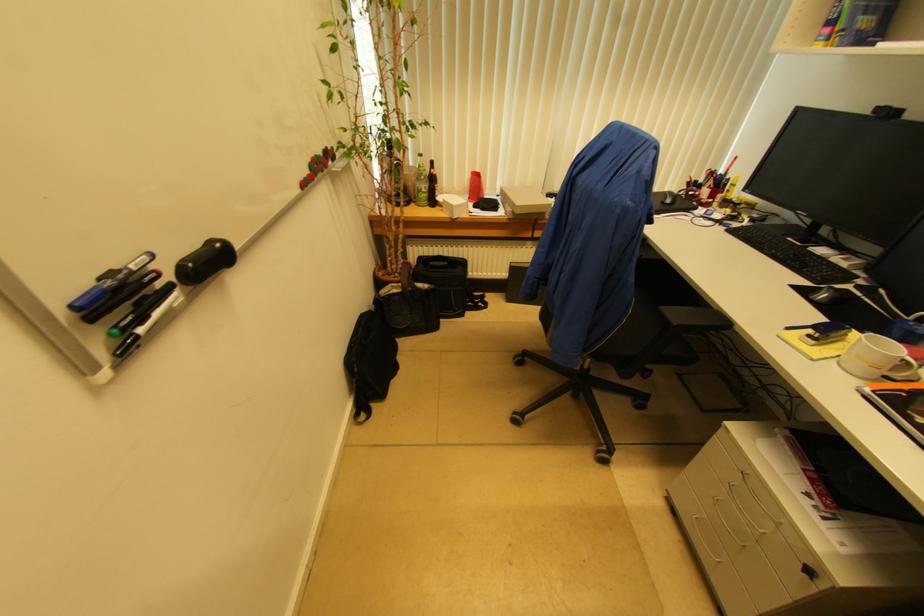
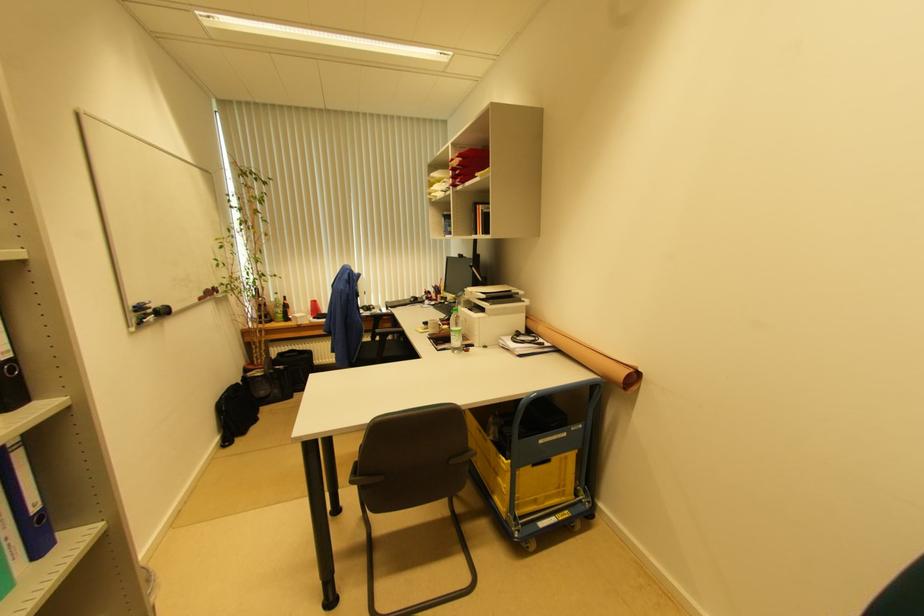
In the second image, find the point that corresponds to the point at 479,174 in the first image.

(315, 302)